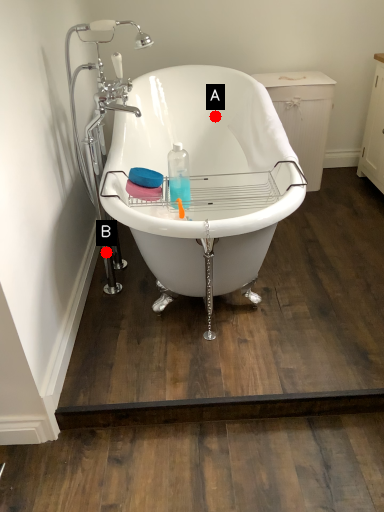
Question: Two points are circled on the image, labeled by A and B beside each circle. Which of the following is the closest to the observer?

Choices:
 (A) A is closer
 (B) B is closer

Answer: (B)